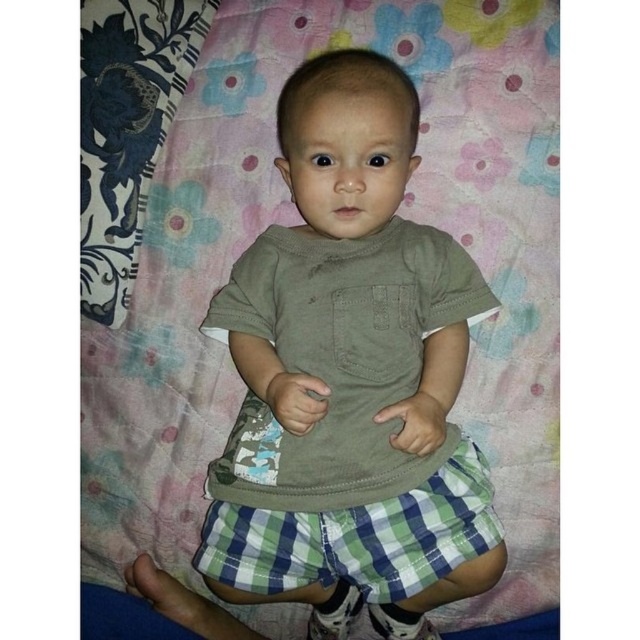
You are trying to decide whether the floral fabric blanket at upper center can cover the green checkered shorts at center. Based on their sizes, would the blanket be big enough?

The floral fabric blanket at upper center has a larger width than the green checkered shorts at center, so yes, the blanket would be big enough to cover the shorts.

You are helping to organize a child room. The floral fabric blanket at upper center and the green checkered shorts at center are on the bed. You need to fold them so they fit into a storage container that can only hold items smaller than the blanket. Which item should you fold first to ensure it fits?

You should fold the green checkered shorts at center first because the floral fabric blanket at upper center is bigger and may not fit into the storage container once folded.